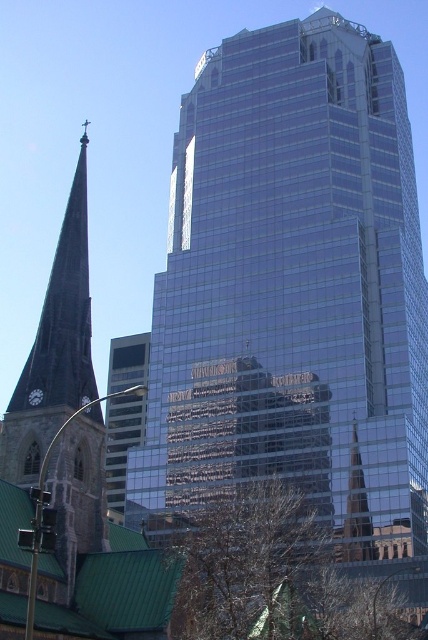
Looking at this image, you are an urban planner assessing the skyline of this city. You notice the clear glass skyscraper at center and the shiny glass spire at center. Which structure would cast a longer shadow during midday when the sun is directly overhead?

The clear glass skyscraper at center has a greater height compared to the shiny glass spire at center, so it would cast a longer shadow during midday when the sun is directly overhead.

You are an urban planner assessing the potential for a new public plaza between the clear glass skyscraper at center and the shiny glass spire at center. Based on their spatial relationship, which structure would you need to consider first when planning sightlines for the plaza?

The clear glass skyscraper at center is in front of the shiny glass spire at center, so you should prioritize considering the clear glass skyscraper at center first when planning sightlines to ensure the spire remains visible from the plaza.